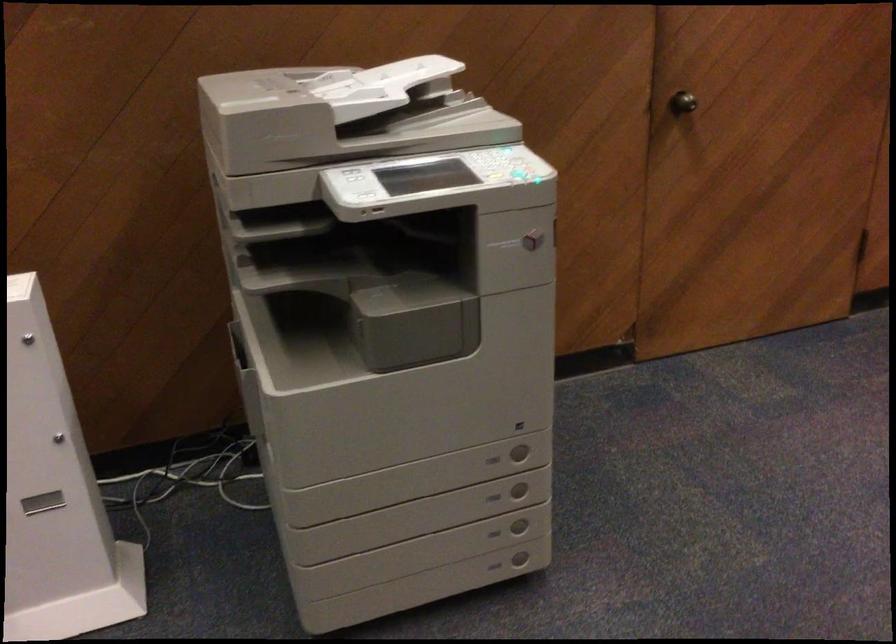
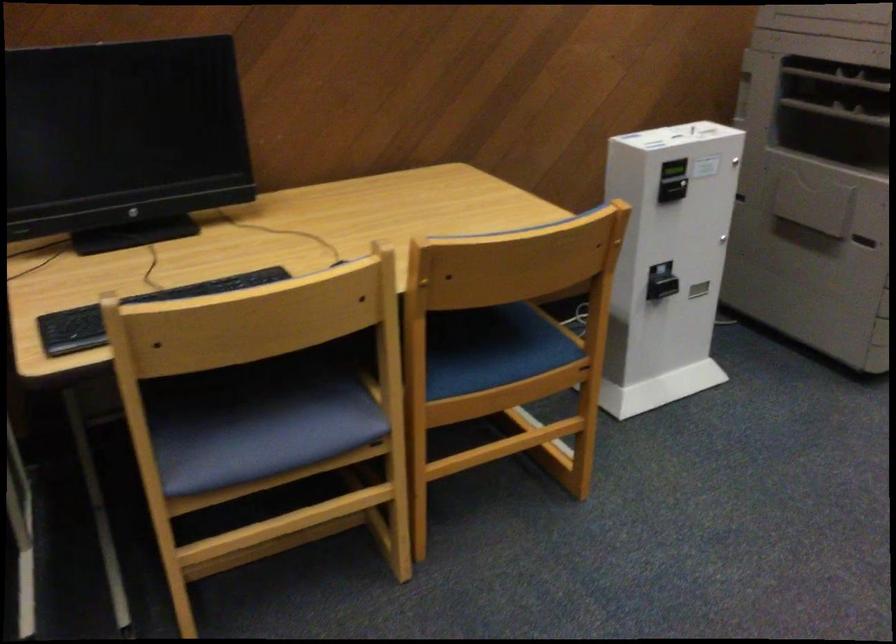
Locate, in the second image, the point that corresponds to (227,225) in the first image.

(839, 79)